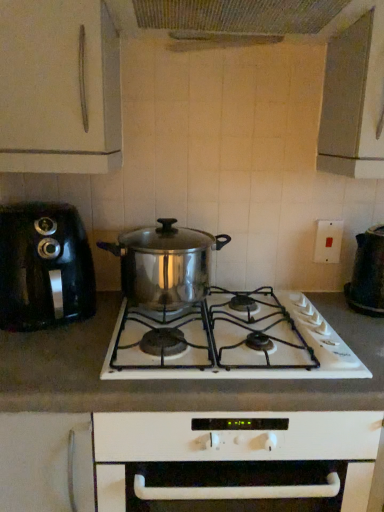
Identify the location of free space in front of black plastic toaster at left, acting as the 1th kitchen appliance starting from the left. (46, 359).